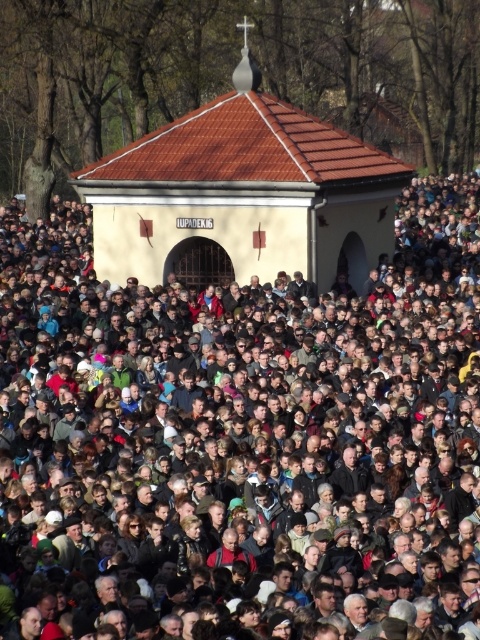
You are part of a crowd trying to reach the chapel entrance. Which building should you approach first, the brown textured building at center or the beige stucco chapel at center?

You should approach the brown textured building at center first because it is in front of the beige stucco chapel at center, making it closer to you.

You are standing in the crowd at the event and want to find the brown textured building at center. According to the coordinates provided, in which direction should you move relative to your current position to reach it?

The brown textured building at center is located at coordinates point (x=242, y=428). Since the coordinates are given in a standard image coordinate system where the origin is at the top left corner, the x increases to the right and y increases downward. Therefore, to reach the building, you should move towards the lower right direction from your current position in the crowd.

You are a photographer trying to capture the entire beige stucco chapel at center and the brown textured building at center in one shot. Based on their positions, which one will appear closer to the bottom of the photo?

The brown textured building at center is located below the beige stucco chapel at center, so it will appear closer to the bottom of the photo.